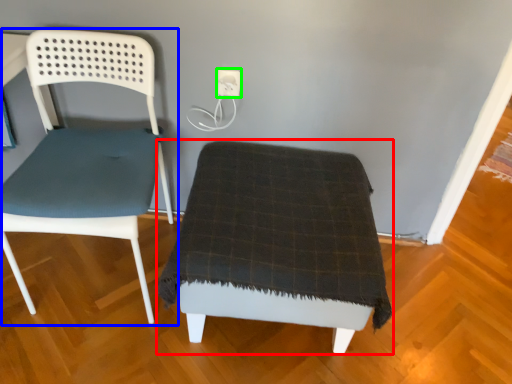
Question: Which object is the farthest from furniture (highlighted by a red box)? Choose among these: chair (highlighted by a blue box) or electric outlet (highlighted by a green box).

Choices:
 (A) chair
 (B) electric outlet

Answer: (B)